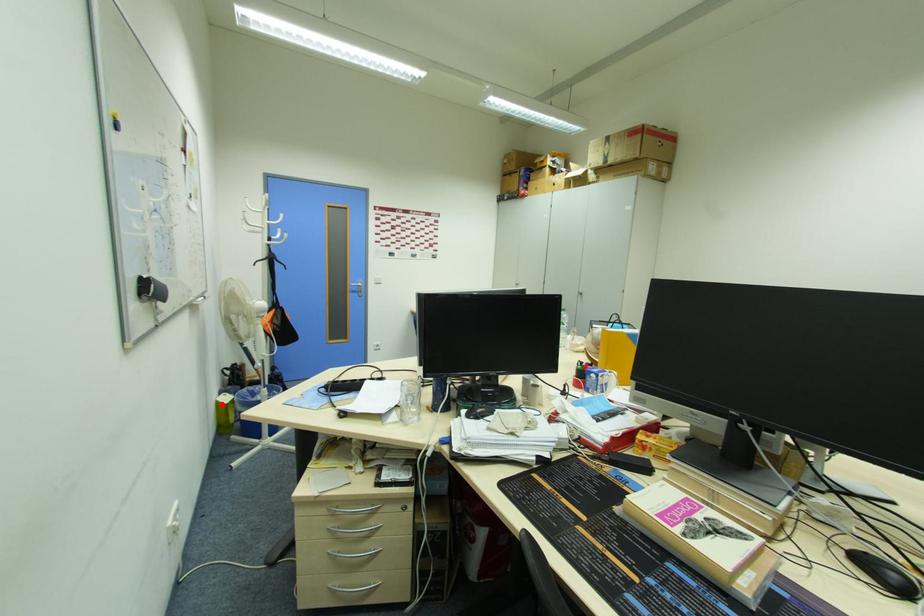
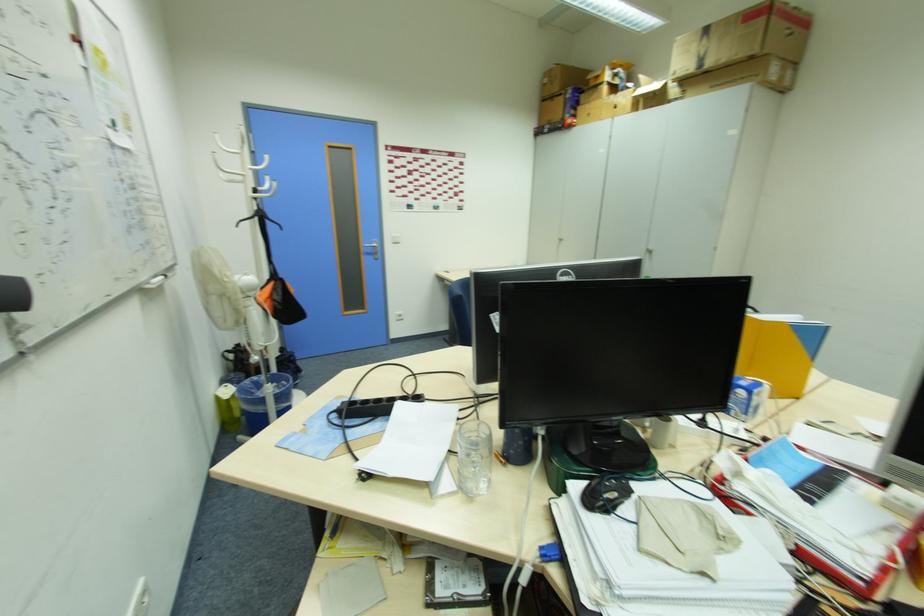
Question: A red point is marked in image1. In image2, is the corresponding 3D point closer to the camera or farther? Reply with the corresponding letter.

Choices:
 (A) The corresponding 3D point is closer.
 (B) The corresponding 3D point is farther.

Answer: (A)